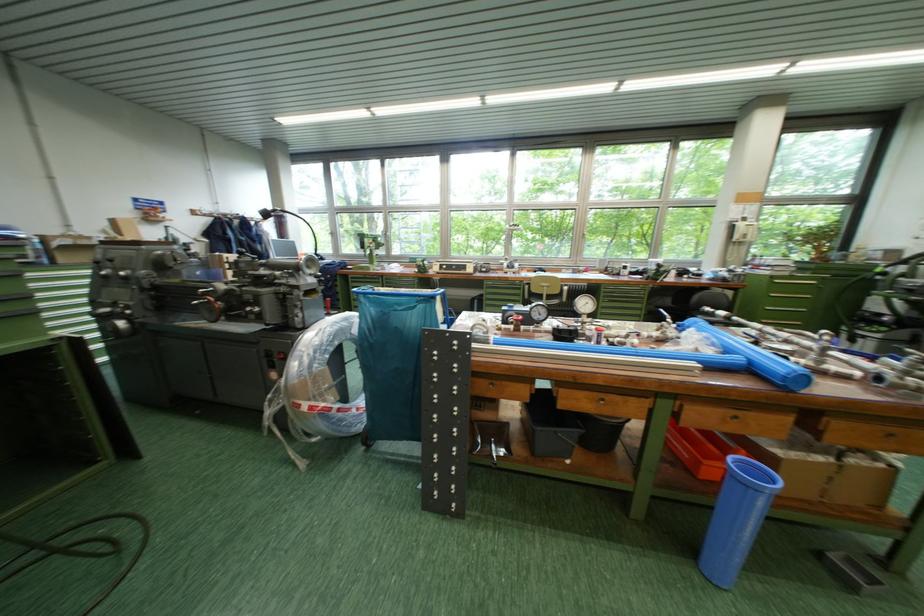
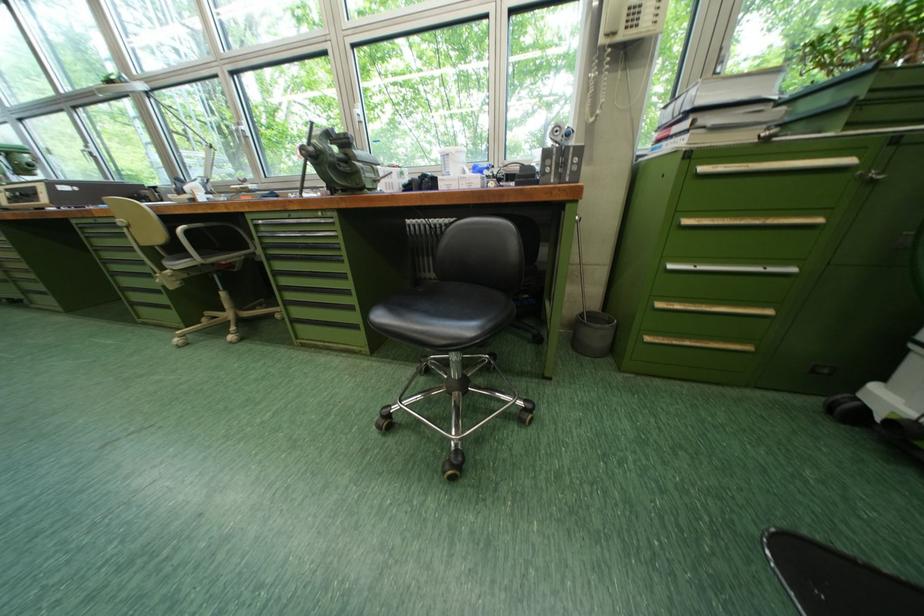
Locate, in the second image, the point that corresponds to point 777,310 in the first image.

(681, 269)